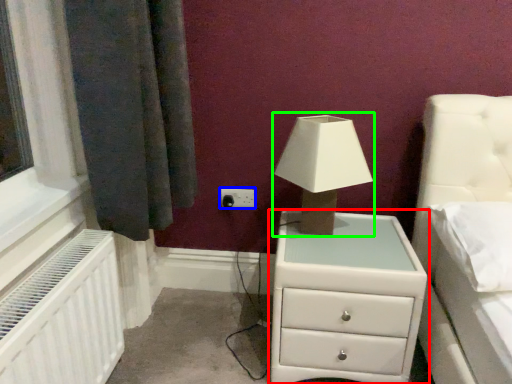
Question: Estimate the real-world distances between objects in this image. Which object is closer to chest of drawers (highlighted by a red box), electric outlet (highlighted by a blue box) or table lamp (highlighted by a green box)?

Choices:
 (A) electric outlet
 (B) table lamp

Answer: (B)